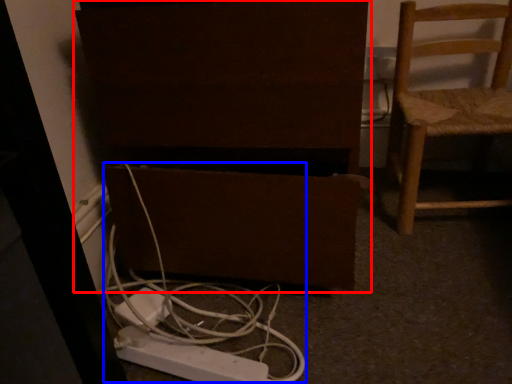
Question: Which object is further to the camera taking this photo, furniture (highlighted by a red box) or cable (highlighted by a blue box)?

Choices:
 (A) furniture
 (B) cable

Answer: (B)